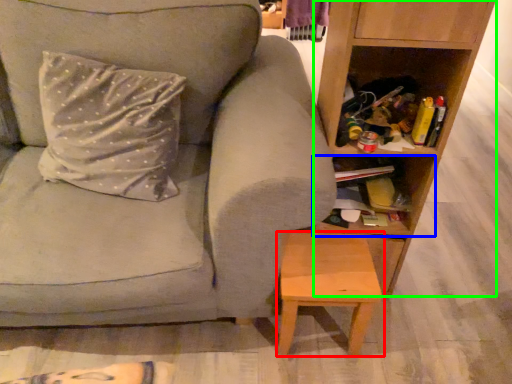
Question: Estimate the real-world distances between objects in this image. Which object is closer to stool (highlighted by a red box), cabinet (highlighted by a blue box) or shelf (highlighted by a green box)?

Choices:
 (A) cabinet
 (B) shelf

Answer: (A)